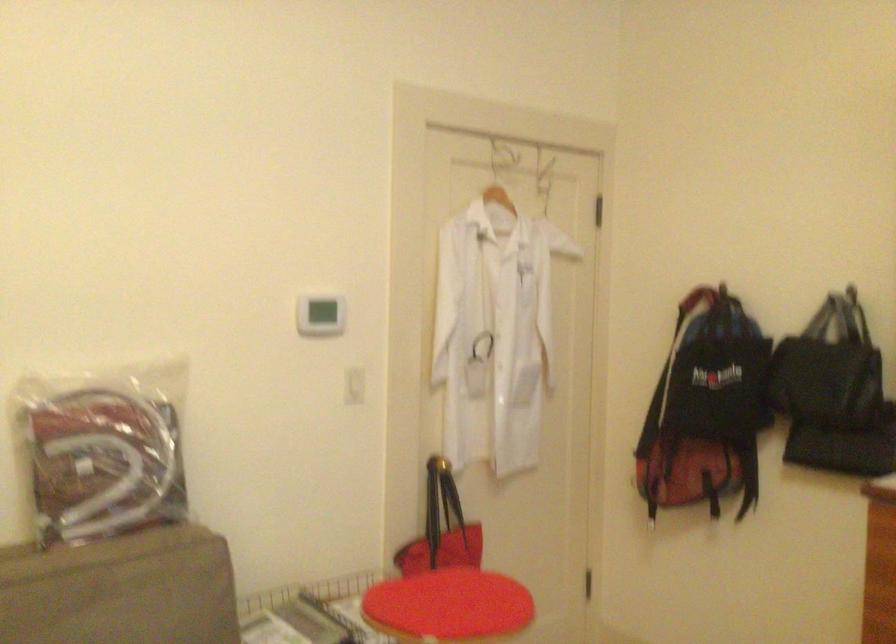
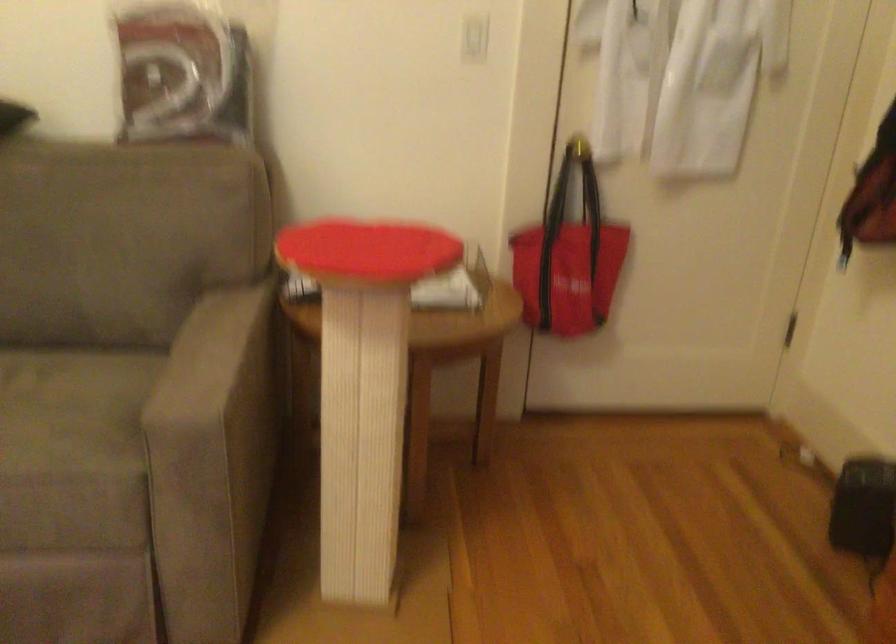
The first image is from the beginning of the video and the second image is from the end. How did the camera likely rotate when shooting the video?

The camera rotated toward left-down.